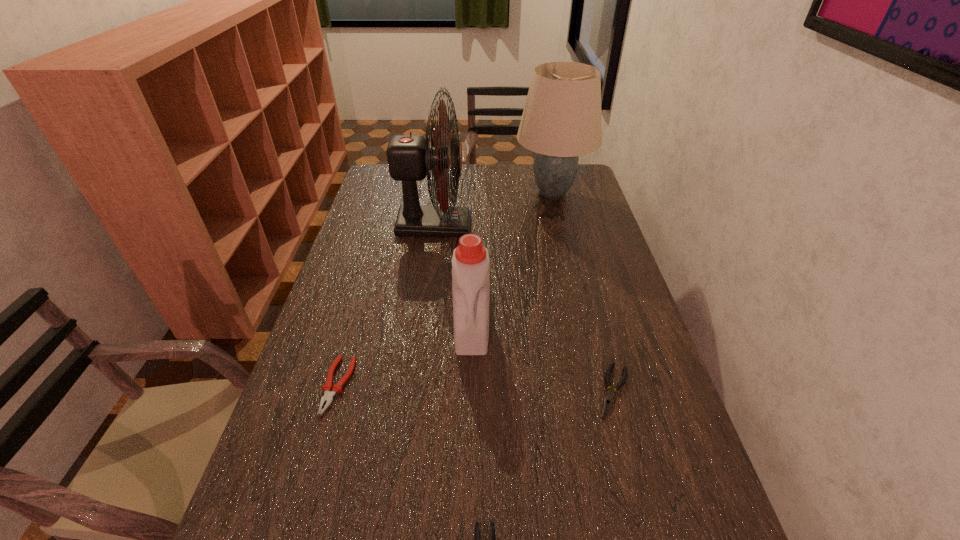
The height and width of the screenshot is (540, 960). I want to click on object positioned at the far edge, so (561, 120).

The height and width of the screenshot is (540, 960). What are the coordinates of `fan present at the left edge` in the screenshot? It's located at (410, 157).

The height and width of the screenshot is (540, 960). What are the coordinates of `pliers located at the left edge` in the screenshot? It's located at (328, 396).

Identify the location of lampshade located at the right edge. (561, 120).

Where is `pliers situated at the right edge`? This screenshot has height=540, width=960. pliers situated at the right edge is located at coordinates (608, 400).

This screenshot has height=540, width=960. In order to click on object at the far right corner in this screenshot , I will do `click(561, 120)`.

Identify the location of free space at the left edge of the desktop. This screenshot has height=540, width=960. (371, 235).

At what (x,y) coordinates should I click in order to perform the action: click on vacant space at the right edge. Please return your answer as a coordinate pair (x, y). This screenshot has height=540, width=960. Looking at the image, I should click on (664, 507).

This screenshot has height=540, width=960. Identify the location of vacant space at the far left corner of the desktop. (372, 178).

In the image, there is a desktop. Where is `vacant space at the far right corner`? vacant space at the far right corner is located at coordinates point(576,174).